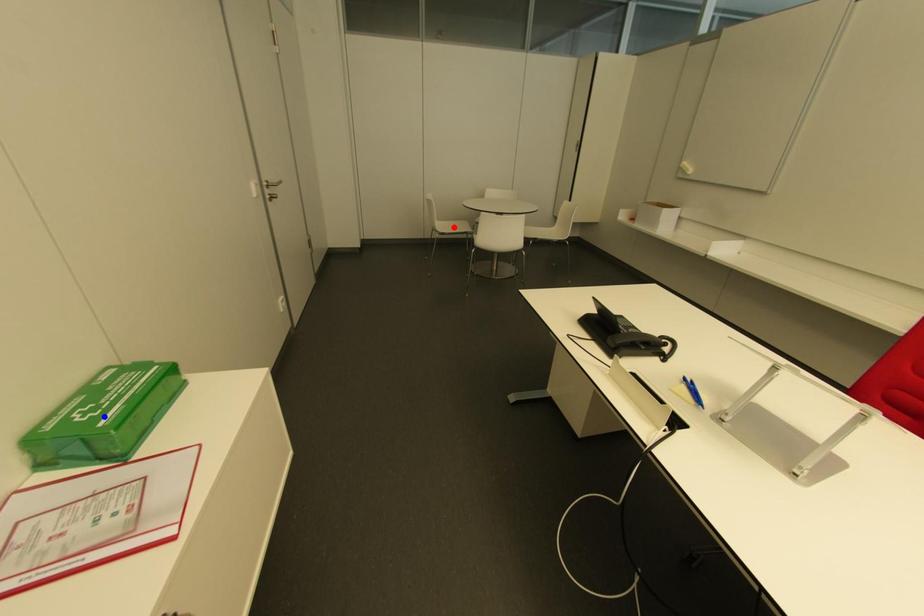
Question: Two points are marked on the image. Which point is closer to the camera?

Choices:
 (A) Blue point is closer.
 (B) Red point is closer.

Answer: (A)